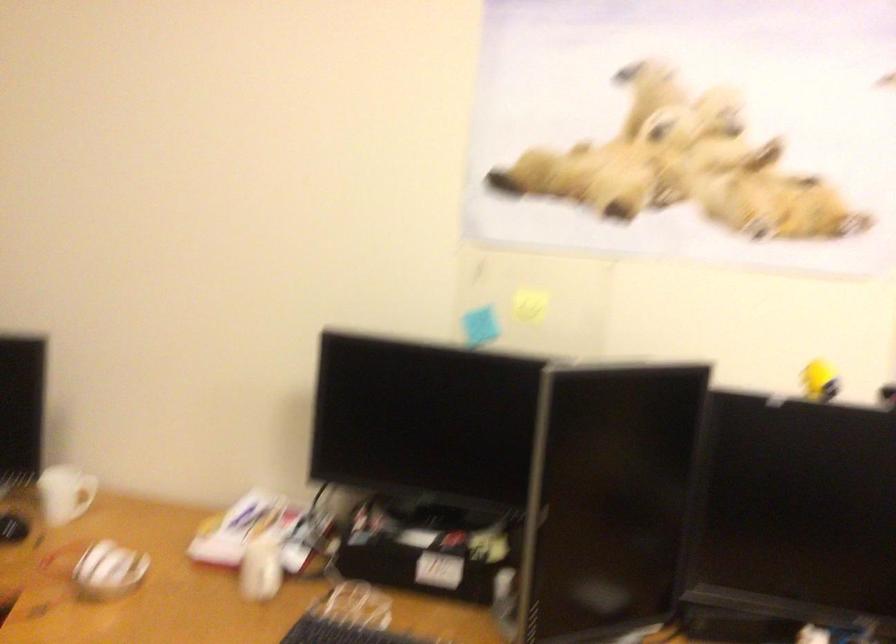
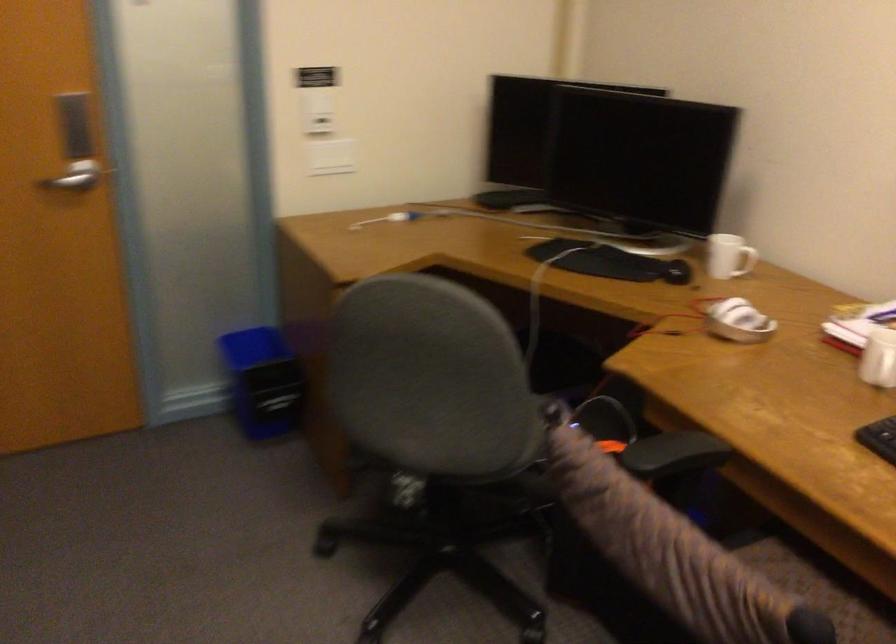
In the second image, find the point that corresponds to pixel 110 572 in the first image.

(737, 321)